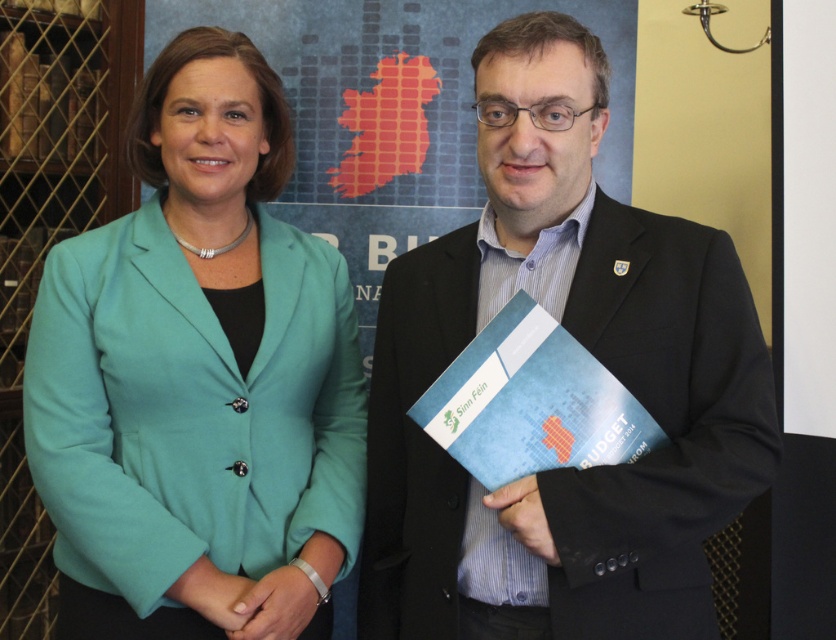
Is teal fabric jacket at center positioned at the back of matte black suit at center?

Yes, teal fabric jacket at center is behind matte black suit at center.

Describe the element at coordinates (197, 378) in the screenshot. The height and width of the screenshot is (640, 836). I see `teal fabric jacket at center` at that location.

The image size is (836, 640). What are the coordinates of `teal fabric jacket at center` in the screenshot? It's located at (197, 378).